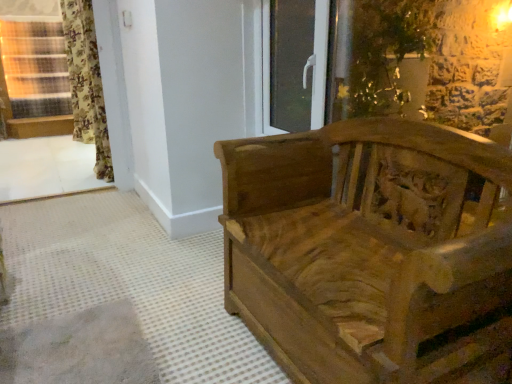
The width and height of the screenshot is (512, 384). What do you see at coordinates (86, 83) in the screenshot? I see `floral fabric curtain at left` at bounding box center [86, 83].

Measure the distance between point (263, 81) and camera.

Point (263, 81) and camera are 7.50 feet apart.

Locate an element on the screen. Image resolution: width=512 pixels, height=384 pixels. floral fabric curtain at left is located at coordinates (86, 83).

Between transparent glass door at upper center and wooden carved bench at right, which one has more height?

wooden carved bench at right is taller.

Is point (290, 1) positioned in front of point (246, 251)?

No, it is not.

Which object is positioned more to the left, transparent glass door at upper center or wooden carved bench at right?

Positioned to the left is transparent glass door at upper center.

Is transparent glass door at upper center outside of wooden carved bench at right?

That's correct, transparent glass door at upper center is outside of wooden carved bench at right.

Identify the location of glass door that appears below the floral fabric curtain at left (from the image's perspective). The image size is (512, 384). (294, 64).

Between point (73, 76) and point (283, 93), which one is positioned behind?

The point (73, 76) is more distant.

In the scene shown: From the image's perspective, is floral fabric curtain at left located above transparent glass door at upper center?

Yes, from the image's perspective, floral fabric curtain at left is over transparent glass door at upper center.

Which object is thinner, floral fabric curtain at left or transparent glass door at upper center?

transparent glass door at upper center is thinner.

Measure the distance between transparent glass door at upper center and wooden window frame at lower left.

transparent glass door at upper center is 5.06 meters from wooden window frame at lower left.

At what (x,y) coordinates should I click in order to perform the action: click on window beneath the transparent glass door at upper center (from a real-world perspective). Please return your answer as a coordinate pair (x, y). Image resolution: width=512 pixels, height=384 pixels. Looking at the image, I should click on pyautogui.click(x=34, y=69).

Does transparent glass door at upper center have a lesser height compared to wooden window frame at lower left?

Indeed, transparent glass door at upper center has a lesser height compared to wooden window frame at lower left.

Considering the sizes of objects transparent glass door at upper center and wooden window frame at lower left in the image provided, who is thinner, transparent glass door at upper center or wooden window frame at lower left?

Thinner between the two is transparent glass door at upper center.

From a real-world perspective, between wooden window frame at lower left and transparent glass door at upper center, who is vertically higher?

In real-world perspective, transparent glass door at upper center is above.

In the scene shown: Does wooden window frame at lower left have a lesser width compared to transparent glass door at upper center?

No.

From the image's perspective, between wooden window frame at lower left and transparent glass door at upper center, who is located below?

wooden window frame at lower left appears lower in the image.

Is wooden window frame at lower left not near transparent glass door at upper center?

wooden window frame at lower left is far away from transparent glass door at upper center.

From the image's perspective, who appears lower, floral fabric curtain at left or wooden carved bench at right?

From the image's view, wooden carved bench at right is below.

Locate an element on the screen. curtain lying behind the wooden carved bench at right is located at coordinates [x=86, y=83].

Choose the correct answer: Is floral fabric curtain at left inside wooden carved bench at right or outside it?

floral fabric curtain at left lies outside wooden carved bench at right.

Considering the relative sizes of floral fabric curtain at left and wooden carved bench at right in the image provided, is floral fabric curtain at left taller than wooden carved bench at right?

Indeed, floral fabric curtain at left has a greater height compared to wooden carved bench at right.

Is wooden window frame at lower left aimed at floral fabric curtain at left?

Yes, wooden window frame at lower left is turned towards floral fabric curtain at left.

From a real-world perspective, does wooden window frame at lower left stand above floral fabric curtain at left?

Actually, wooden window frame at lower left is physically below floral fabric curtain at left in the real world.

From the image's perspective, who appears lower, wooden window frame at lower left or floral fabric curtain at left?

wooden window frame at lower left.

From the picture: Measure the distance between wooden window frame at lower left and wooden carved bench at right.

They are 5.74 meters apart.

Is wooden window frame at lower left not near wooden carved bench at right?

Yes, wooden window frame at lower left and wooden carved bench at right are located far from each other.

Is wooden window frame at lower left taller or shorter than wooden carved bench at right?

In the image, wooden window frame at lower left appears to be taller than wooden carved bench at right.

Find the location of `glass door above the wooden carved bench at right (from a real-world perspective)`. glass door above the wooden carved bench at right (from a real-world perspective) is located at coordinates (294, 64).

Image resolution: width=512 pixels, height=384 pixels. What are the coordinates of `glass door located in front of the floral fabric curtain at left` in the screenshot? It's located at (294, 64).

When comparing their distances from floral fabric curtain at left, does wooden window frame at lower left or transparent glass door at upper center seem further?

transparent glass door at upper center.

From the image, which object appears to be nearer to floral fabric curtain at left, wooden window frame at lower left or wooden carved bench at right?

The object closer to floral fabric curtain at left is wooden window frame at lower left.

Based on the photo, estimate the real-world distances between objects in this image. Which object is further from wooden window frame at lower left, wooden carved bench at right or floral fabric curtain at left?

wooden carved bench at right is positioned further to the anchor wooden window frame at lower left.

Considering their positions, is wooden window frame at lower left positioned closer to transparent glass door at upper center than wooden carved bench at right?

wooden carved bench at right lies closer to transparent glass door at upper center than the other object.

Considering their positions, is floral fabric curtain at left positioned closer to wooden window frame at lower left than transparent glass door at upper center?

Among the two, floral fabric curtain at left is located nearer to wooden window frame at lower left.

When comparing their distances from floral fabric curtain at left, does transparent glass door at upper center or wooden carved bench at right seem further?

wooden carved bench at right is further to floral fabric curtain at left.

Which object lies further to the anchor point wooden carved bench at right, floral fabric curtain at left or wooden window frame at lower left?

wooden window frame at lower left lies further to wooden carved bench at right than the other object.

Looking at the image, which one is located further to wooden carved bench at right, floral fabric curtain at left or transparent glass door at upper center?

floral fabric curtain at left is further to wooden carved bench at right.

Find the location of a particular element. The height and width of the screenshot is (384, 512). window between wooden carved bench at right and floral fabric curtain at left in the front-back direction is located at coordinates (34, 69).

Locate an element on the screen. glass door located between wooden window frame at lower left and wooden carved bench at right in the left-right direction is located at coordinates (294, 64).

Image resolution: width=512 pixels, height=384 pixels. What are the coordinates of `curtain between wooden window frame at lower left and transparent glass door at upper center from left to right` in the screenshot? It's located at (86, 83).

Find the location of a particular element. glass door between wooden carved bench at right and floral fabric curtain at left from front to back is located at coordinates (294, 64).